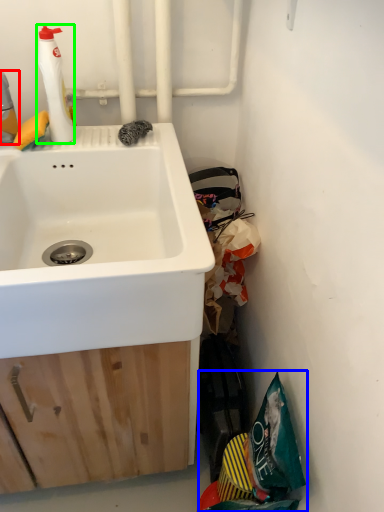
Question: Considering the real-world distances, which object is closest to cleaning product (highlighted by a red box)? garbage (highlighted by a blue box) or cleaning product (highlighted by a green box).

Choices:
 (A) garbage
 (B) cleaning product

Answer: (B)